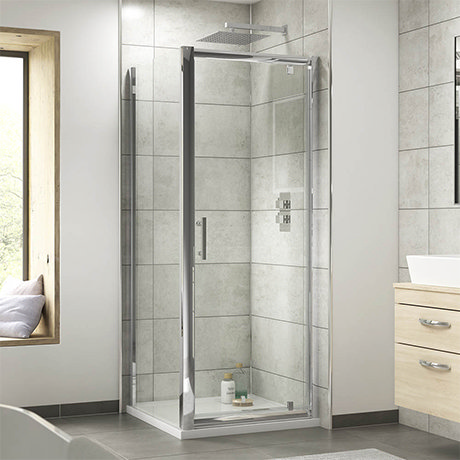
I want to click on window, so click(x=6, y=255).